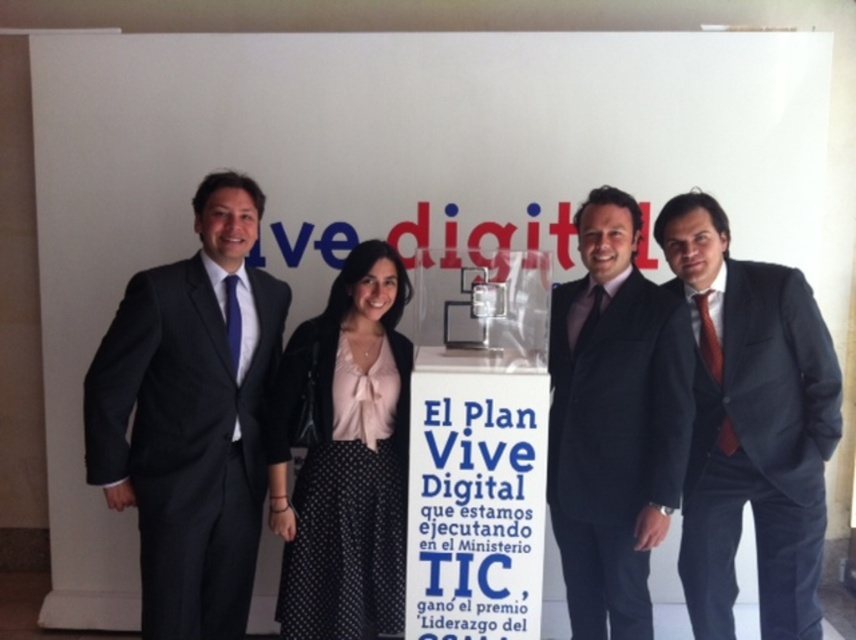
Is matte black suit at right wider than dark gray suit at center?

Yes, matte black suit at right is wider than dark gray suit at center.

Does point (788, 268) come farther from viewer compared to point (595, 449)?

That is True.

The height and width of the screenshot is (640, 856). I want to click on matte black suit at right, so click(x=752, y=426).

Can you confirm if dark gray suit at left is taller than black polka dot skirt at center?

Yes.

Can you confirm if dark gray suit at left is shorter than black polka dot skirt at center?

No.

You are a GUI agent. You are given a task and a screenshot of the screen. Output one action in this format:
    pyautogui.click(x=<x>, y=<y>)
    Task: Click on the dark gray suit at left
    This screenshot has height=640, width=856.
    Given the screenshot: What is the action you would take?
    pyautogui.click(x=191, y=417)

Between dark gray suit at center and black polka dot skirt at center, which one is positioned lower?

black polka dot skirt at center is lower down.

Who is shorter, dark gray suit at center or black polka dot skirt at center?

Standing shorter between the two is black polka dot skirt at center.

This screenshot has height=640, width=856. Describe the element at coordinates (614, 420) in the screenshot. I see `dark gray suit at center` at that location.

At what (x,y) coordinates should I click in order to perform the action: click on dark gray suit at center. Please return your answer as a coordinate pair (x, y). Image resolution: width=856 pixels, height=640 pixels. Looking at the image, I should click on (614, 420).